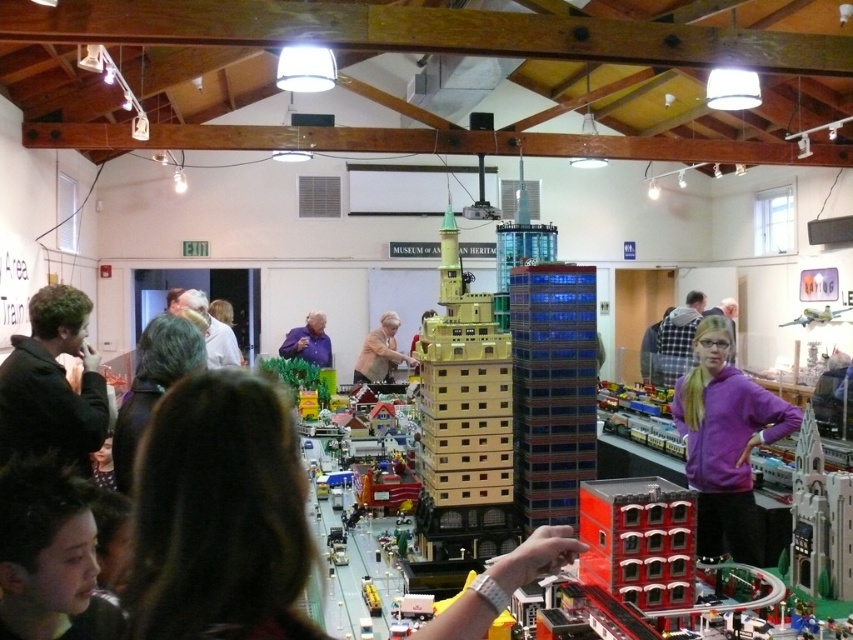
Who is positioned more to the left, brown hair at center or dark brown hair at center?

From the viewer's perspective, dark brown hair at center appears more on the left side.

Measure the distance from brown hair at center to dark brown hair at center.

They are 1.52 meters apart.

Which is behind, point (215, 417) or point (129, 461)?

Positioned behind is point (129, 461).

The image size is (853, 640). I want to click on brown hair at center, so click(219, 515).

Is point (686, 436) more distant than point (236, 364)?

No.

Which is more to the right, purple fleece at center or light brown hair at center?

From the viewer's perspective, purple fleece at center appears more on the right side.

Identify the location of purple fleece at center. (724, 440).

Does smooth red building at center have a smaller size compared to purple matte shirt at center?

Yes.

Does smooth red building at center lie in front of purple matte shirt at center?

Yes, it is.

Which is behind, point (584, 509) or point (281, 353)?

Point (281, 353)

This screenshot has width=853, height=640. Find the location of `smooth red building at center`. smooth red building at center is located at coordinates (637, 540).